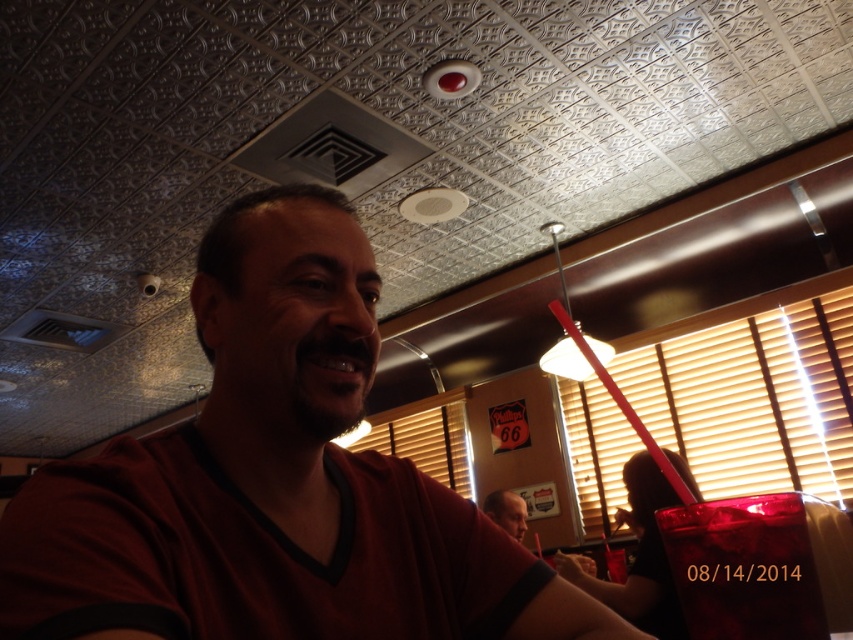
Consider the image. Does matte red shirt at center have a lesser width compared to translucent plastic cup at lower right?

No.

Describe the element at coordinates (273, 481) in the screenshot. This screenshot has height=640, width=853. I see `matte red shirt at center` at that location.

Where is `matte red shirt at center`? matte red shirt at center is located at coordinates (273, 481).

Which is more to the left, matte black shirt at center or translucent plastic cup at lower right?

matte black shirt at center is more to the left.

Is matte black shirt at center closer to the viewer compared to translucent plastic cup at lower right?

Yes.

Is point (514, 538) positioned in front of point (616, 556)?

Yes.

You are a GUI agent. You are given a task and a screenshot of the screen. Output one action in this format:
    pyautogui.click(x=<x>, y=<y>)
    Task: Click on the matte black shirt at center
    
    Given the screenshot: What is the action you would take?
    pyautogui.click(x=508, y=512)

Between matte red shirt at center and matte black shirt at center, which one has more height?

With more height is matte red shirt at center.

Identify the location of matte red shirt at center. Image resolution: width=853 pixels, height=640 pixels. (273, 481).